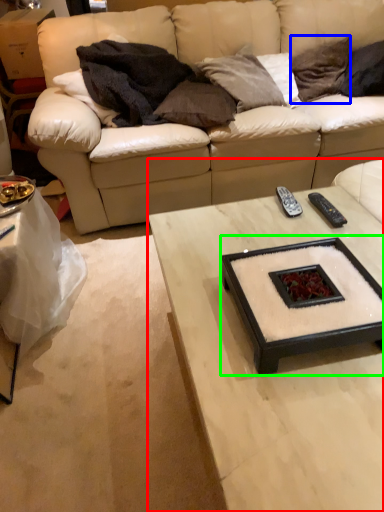
Question: Estimate the real-world distances between objects in this image. Which object is farther from coffee table (highlighted by a red box), pillow (highlighted by a blue box) or round table (highlighted by a green box)?

Choices:
 (A) pillow
 (B) round table

Answer: (A)